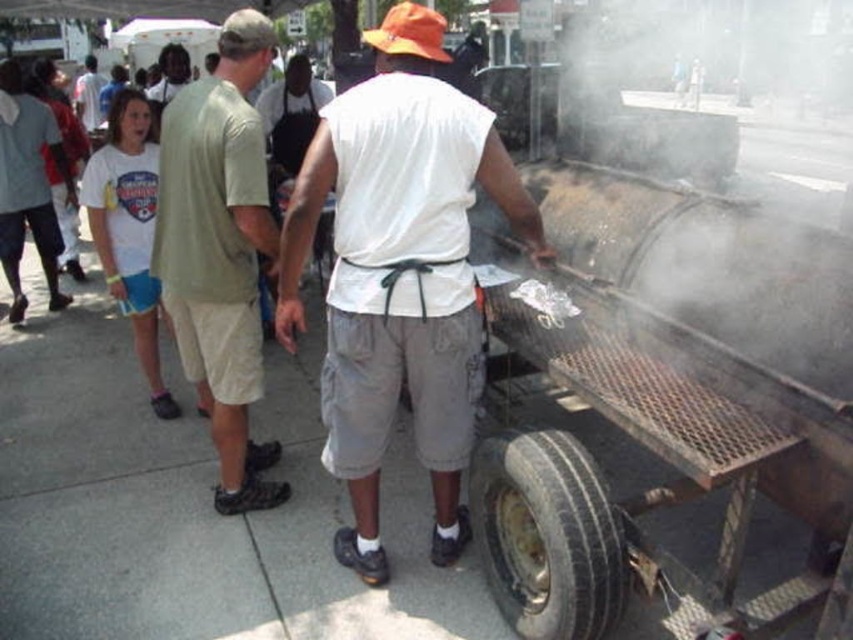
You are a photographer trying to capture a photo of the matte black shirt at center without including the black rubber tire at lower right in the frame. Based on their positions, is this possible?

The black rubber tire at lower right is positioned on the right side of matte black shirt at center, so if you position yourself to the left of the matte black shirt at center, you can avoid including the black rubber tire at lower right in your photo.

You are standing at the point marked as point (409, 33) in the image. What object is directly below this point?

The point (409, 33) is on orange fabric baseball cap at upper center, so the object directly below this point would be the cap itself or the area immediately beneath it, but since the question specifies the object, the answer is the orange fabric baseball cap at upper center.

In the scene shown: You are standing at the black rubber tire at lower right and want to hand a tool to the person wearing the white cotton shirt at upper center. Can you reach them without moving from your current position?

The black rubber tire at lower right and white cotton shirt at upper center are 9.80 meters apart from each other. Since the distance is too far to reach without moving, you cannot hand the tool directly from your current position.